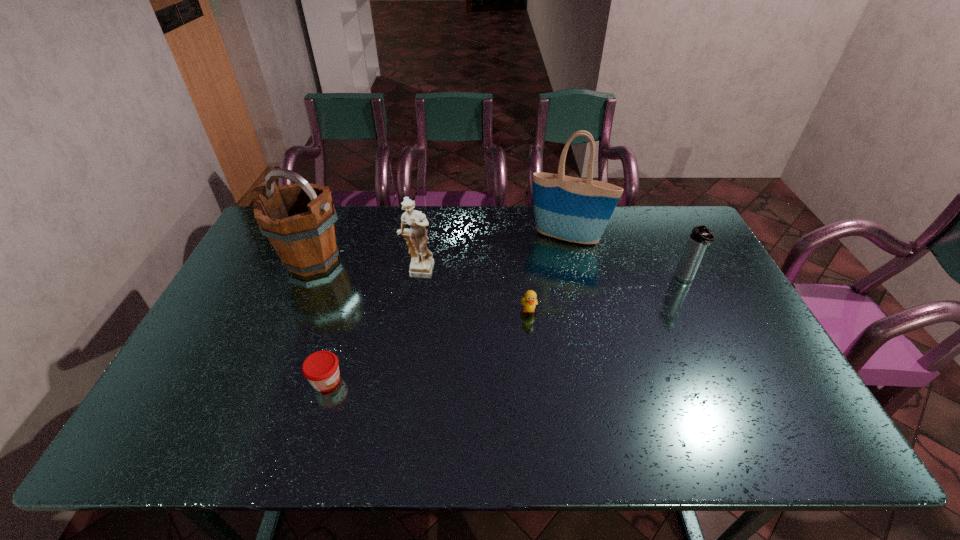
Locate an element on the screen. free space between the duckling and the third object from left to right is located at coordinates (473, 292).

The image size is (960, 540). I want to click on free space between the nearest object and the third object from left to right, so tap(372, 327).

The image size is (960, 540). Identify the location of empty space that is in between the tote bag and the leftmost object. (441, 249).

Locate an element on the screen. The width and height of the screenshot is (960, 540). free area in between the nearest object and the third shortest object is located at coordinates (506, 330).

Where is `free area in between the second object from right to left and the fourth shortest object`? This screenshot has height=540, width=960. free area in between the second object from right to left and the fourth shortest object is located at coordinates (492, 256).

Where is `free space between the tote bag and the fourth shortest object`? The image size is (960, 540). free space between the tote bag and the fourth shortest object is located at coordinates point(492,256).

Identify which object is the fifth nearest to the third tallest object. Please provide its 2D coordinates. Your answer should be formatted as a tuple, i.e. [(x, y)], where the tuple contains the x and y coordinates of a point satisfying the conditions above.

[(701, 236)]

Choose which object is the second nearest neighbor to the bucket. Please provide its 2D coordinates. Your answer should be formatted as a tuple, i.e. [(x, y)], where the tuple contains the x and y coordinates of a point satisfying the conditions above.

[(321, 369)]

The image size is (960, 540). I want to click on vacant region that satisfies the following two spatial constraints: 1. on the handle side of the rightmost object; 2. on the label side of the second object from left to right, so tap(733, 380).

Where is `vacant space that satisfies the following two spatial constraints: 1. on the handle side of the thermos bottle; 2. on the label side of the jam`? vacant space that satisfies the following two spatial constraints: 1. on the handle side of the thermos bottle; 2. on the label side of the jam is located at coordinates (733, 380).